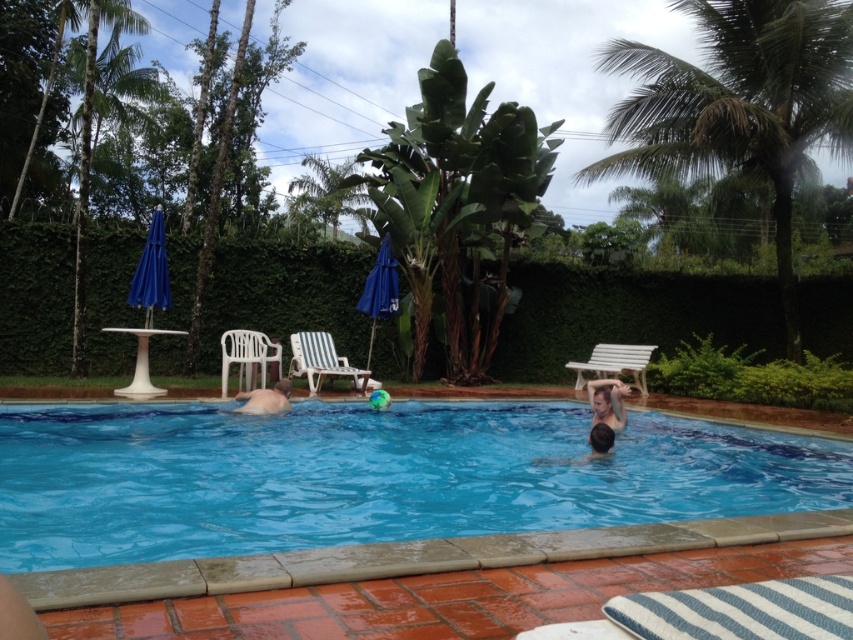
Question: Is green leafy palm tree at upper right below smooth skin person at center?

Choices:
 (A) yes
 (B) no

Answer: (B)

Question: Which is nearer to the smooth skin head at center?

Choices:
 (A) white plastic chair at center
 (B) white plastic bench at upper right
 (C) fat man at center

Answer: (C)

Question: Can you confirm if green leafy palm tree at upper right is positioned below white plastic chair at center?

Choices:
 (A) no
 (B) yes

Answer: (A)

Question: Among these points, which one is farthest from the camera?

Choices:
 (A) (268, 396)
 (B) (361, 378)
 (C) (593, 408)
 (D) (612, 440)

Answer: (B)

Question: Can you confirm if clear blue water at center is thinner than striped fabric lounge chair at center?

Choices:
 (A) no
 (B) yes

Answer: (B)

Question: Among these objects, which one is farthest from the camera?

Choices:
 (A) white plastic chair at center
 (B) green leafy palm tree at left
 (C) fat man at center
 (D) white plastic bench at upper right

Answer: (D)